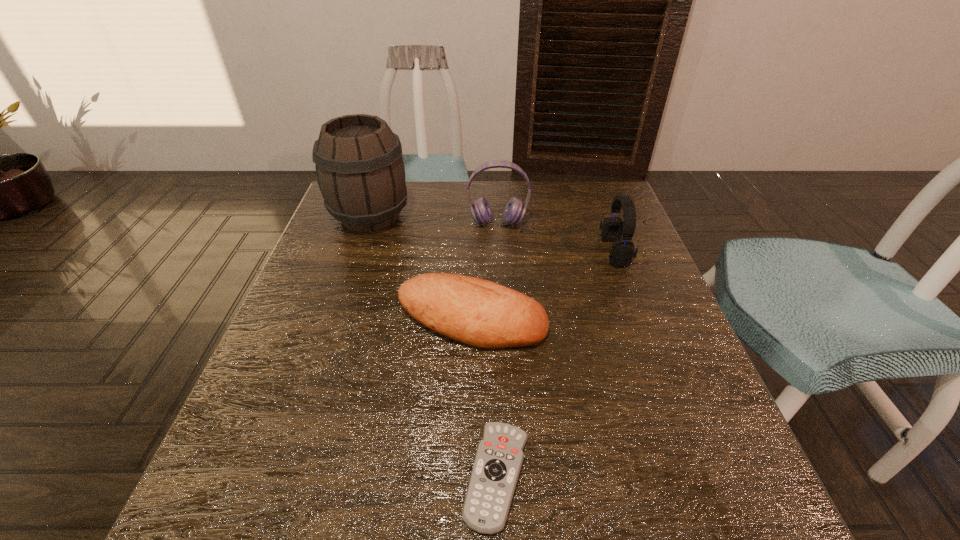
The height and width of the screenshot is (540, 960). I want to click on free location located 0.270m on the right of the tallest object, so click(507, 216).

Where is `free spot located on the headband and ear cups of the taller headset`? free spot located on the headband and ear cups of the taller headset is located at coordinates (502, 310).

Locate an element on the screen. free space located on the headband of the right headset is located at coordinates (456, 252).

This screenshot has height=540, width=960. In order to click on free location located 0.110m on the headband of the right headset in this screenshot , I will do (x=559, y=252).

Where is `vacant space located on the headband of the right headset`? The width and height of the screenshot is (960, 540). vacant space located on the headband of the right headset is located at coordinates (519, 252).

Locate an element on the screen. The width and height of the screenshot is (960, 540). blank area located 0.120m on the back of the bread is located at coordinates (473, 258).

The image size is (960, 540). Identify the location of free region located 0.280m on the right of the remote control. (709, 476).

Locate an element on the screen. This screenshot has width=960, height=540. wine bucket that is at the far edge is located at coordinates (360, 171).

Identify the location of headset at the far edge. Image resolution: width=960 pixels, height=540 pixels. (514, 211).

Where is `object positioned at the near edge`? Image resolution: width=960 pixels, height=540 pixels. object positioned at the near edge is located at coordinates (499, 456).